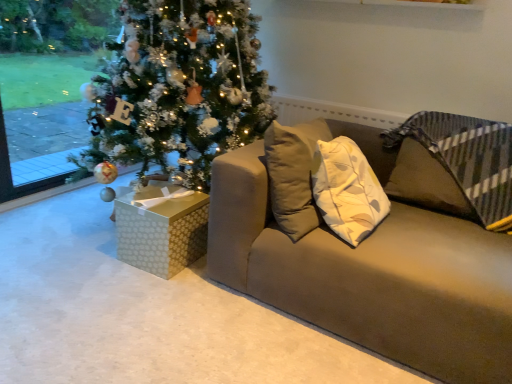
I want to click on matte brown couch at center, so click(376, 263).

The height and width of the screenshot is (384, 512). Describe the element at coordinates (376, 263) in the screenshot. I see `matte brown couch at center` at that location.

Image resolution: width=512 pixels, height=384 pixels. Identify the location of gold-patterned gift box at lower left. (161, 228).

Measure the distance between point (x=146, y=217) and camera.

Point (x=146, y=217) is 5.88 feet away from camera.

What do you see at coordinates (161, 228) in the screenshot?
I see `gold-patterned gift box at lower left` at bounding box center [161, 228].

Where is `matte brown couch at center`? The image size is (512, 384). matte brown couch at center is located at coordinates pos(376,263).

Between gold-patterned gift box at lower left and matte brown couch at center, which one appears on the left side from the viewer's perspective?

From the viewer's perspective, gold-patterned gift box at lower left appears more on the left side.

In the image, is gold-patterned gift box at lower left positioned in front of or behind matte brown couch at center?

In the image, gold-patterned gift box at lower left appears behind matte brown couch at center.

Is point (198, 229) closer to viewer compared to point (365, 292)?

That is False.

From the image's perspective, is gold-patterned gift box at lower left located beneath matte brown couch at center?

Correct, gold-patterned gift box at lower left appears lower than matte brown couch at center in the image.

From a real-world perspective, which object rests below the other?

gold-patterned gift box at lower left, from a real-world perspective.

Looking at this image, can you confirm if gold-patterned gift box at lower left is wider than matte brown couch at center?

No, gold-patterned gift box at lower left is not wider than matte brown couch at center.

Can you confirm if gold-patterned gift box at lower left is taller than matte brown couch at center?

No.

Is gold-patterned gift box at lower left smaller than matte brown couch at center?

Yes, gold-patterned gift box at lower left is smaller than matte brown couch at center.

Is gold-patterned gift box at lower left spatially inside matte brown couch at center, or outside of it?

gold-patterned gift box at lower left is spatially situated outside matte brown couch at center.

Would you say gold-patterned gift box at lower left is a long distance from matte brown couch at center?

No.

Is gold-patterned gift box at lower left facing away from matte brown couch at center?

gold-patterned gift box at lower left does not have its back to matte brown couch at center.

How many degrees apart are the facing directions of gold-patterned gift box at lower left and matte brown couch at center?

The facing directions of gold-patterned gift box at lower left and matte brown couch at center are 3.62 degrees apart.

Measure the distance between gold-patterned gift box at lower left and matte brown couch at center.

The distance of gold-patterned gift box at lower left from matte brown couch at center is 20.11 inches.

Where is `studio couch on the right of gold-patterned gift box at lower left`? studio couch on the right of gold-patterned gift box at lower left is located at coordinates (376, 263).

In the scene shown: Considering the relative positions of matte brown couch at center and gold-patterned gift box at lower left in the image provided, is matte brown couch at center to the left or to the right of gold-patterned gift box at lower left?

In the image, matte brown couch at center appears on the right side of gold-patterned gift box at lower left.

Which object is further away from the camera, matte brown couch at center or gold-patterned gift box at lower left?

gold-patterned gift box at lower left is behind.

Which point is more distant from viewer, (276, 243) or (125, 206)?

Positioned behind is point (125, 206).

From the image's perspective, is matte brown couch at center positioned above or below gold-patterned gift box at lower left?

matte brown couch at center is situated higher than gold-patterned gift box at lower left in the image.

From a real-world perspective, which object rests below the other?

gold-patterned gift box at lower left is physically lower.

Between matte brown couch at center and gold-patterned gift box at lower left, which one has larger width?

matte brown couch at center.

In terms of height, does matte brown couch at center look taller or shorter compared to gold-patterned gift box at lower left?

Clearly, matte brown couch at center is taller compared to gold-patterned gift box at lower left.

Considering the sizes of objects matte brown couch at center and gold-patterned gift box at lower left in the image provided, who is smaller, matte brown couch at center or gold-patterned gift box at lower left?

Smaller between the two is gold-patterned gift box at lower left.

Is matte brown couch at center situated inside gold-patterned gift box at lower left or outside?

matte brown couch at center is not enclosed by gold-patterned gift box at lower left.

Is matte brown couch at center next to gold-patterned gift box at lower left and touching it?

No, matte brown couch at center is not touching gold-patterned gift box at lower left.

Is matte brown couch at center oriented away from gold-patterned gift box at lower left?

No.

Can you tell me how much matte brown couch at center and gold-patterned gift box at lower left differ in facing direction?

3.62 degrees separate the facing orientations of matte brown couch at center and gold-patterned gift box at lower left.

This screenshot has height=384, width=512. Identify the location of studio couch positioned vertically above the gold-patterned gift box at lower left (from a real-world perspective). (376, 263).

Identify the location of furniture behind the matte brown couch at center. This screenshot has height=384, width=512. (161, 228).

Identify the location of studio couch above the gold-patterned gift box at lower left (from the image's perspective). Image resolution: width=512 pixels, height=384 pixels. (376, 263).